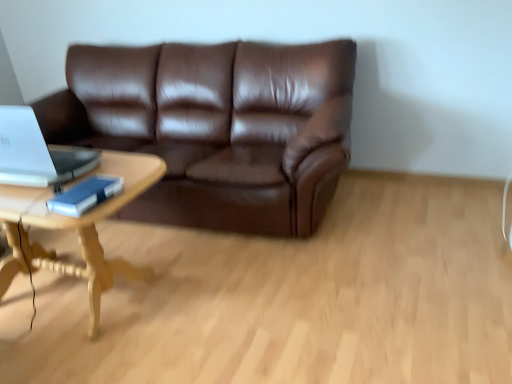
Locate an element on the screen. blank area beneath blue matte book at left (from a real-world perspective) is located at coordinates coord(78,203).